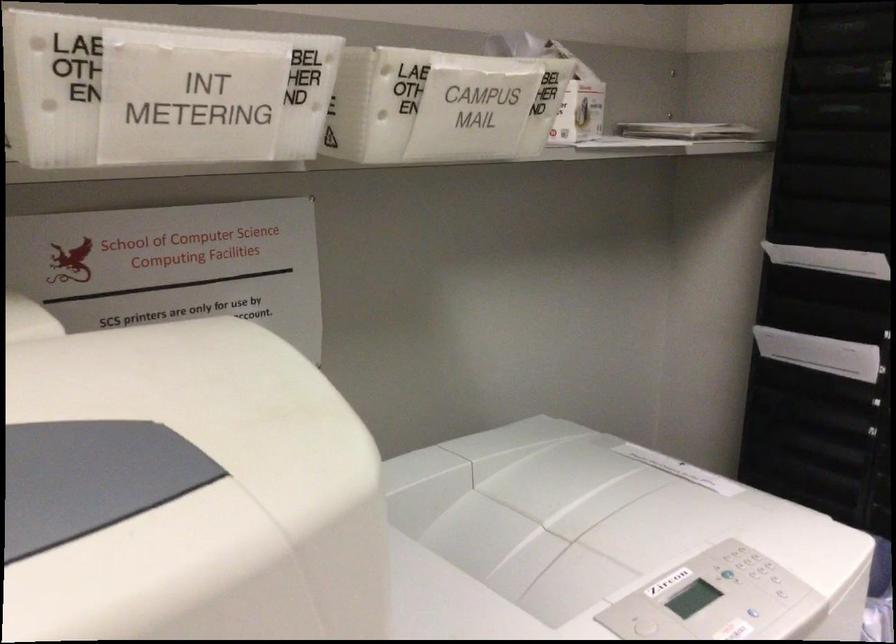
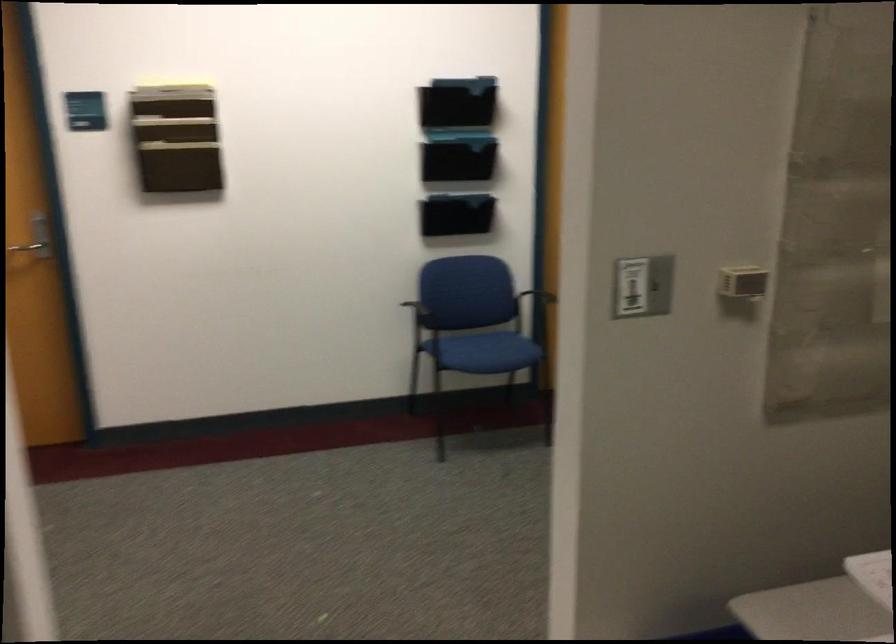
Question: The camera is either moving clockwise (left) or counter-clockwise (right) around the object. The first image is from the beginning of the video and the second image is from the end. Is the camera moving left or right when shooting the video?

Choices:
 (A) Left
 (B) Right

Answer: (A)